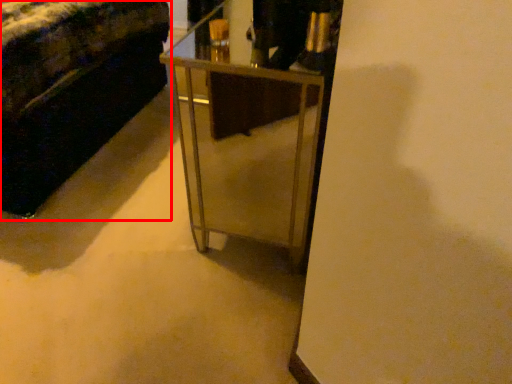
Question: Considering the relative positions of furniture (annotated by the red box) and table in the image provided, where is furniture (annotated by the red box) located with respect to the staircase?

Choices:
 (A) right
 (B) left

Answer: (B)